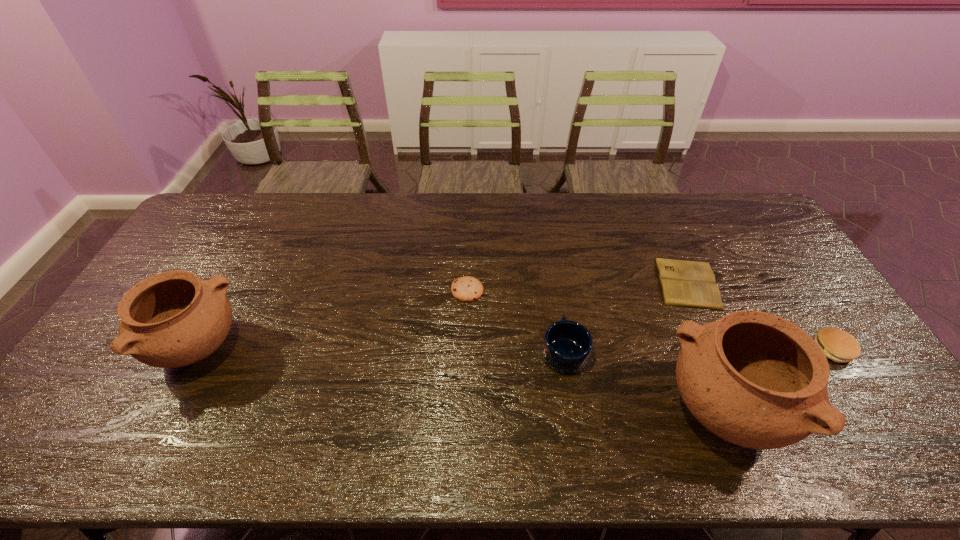
Identify the location of object at the right edge. (838, 345).

I want to click on object at the near left corner, so click(x=172, y=319).

Image resolution: width=960 pixels, height=540 pixels. Find the location of `free space at the far edge of the desktop`. free space at the far edge of the desktop is located at coordinates (534, 197).

This screenshot has height=540, width=960. What are the coordinates of `free space at the near edge of the desktop` in the screenshot? It's located at (159, 397).

This screenshot has width=960, height=540. Find the location of `vacant space at the left edge of the desktop`. vacant space at the left edge of the desktop is located at coordinates (103, 360).

Identify the location of vacant area at the right edge. (774, 268).

Locate an element on the screen. vacant region between the second object from left to right and the left pottery is located at coordinates (332, 320).

The image size is (960, 540). Find the location of `vacant area between the right pottery and the fifth object from right to left`. vacant area between the right pottery and the fifth object from right to left is located at coordinates coord(595,350).

Locate an element on the screen. This screenshot has width=960, height=540. free space between the fourth object from right to left and the tallest object is located at coordinates (644, 381).

This screenshot has height=540, width=960. What are the coordinates of `vacant space in between the left pottery and the second shortest object` in the screenshot? It's located at point(332,320).